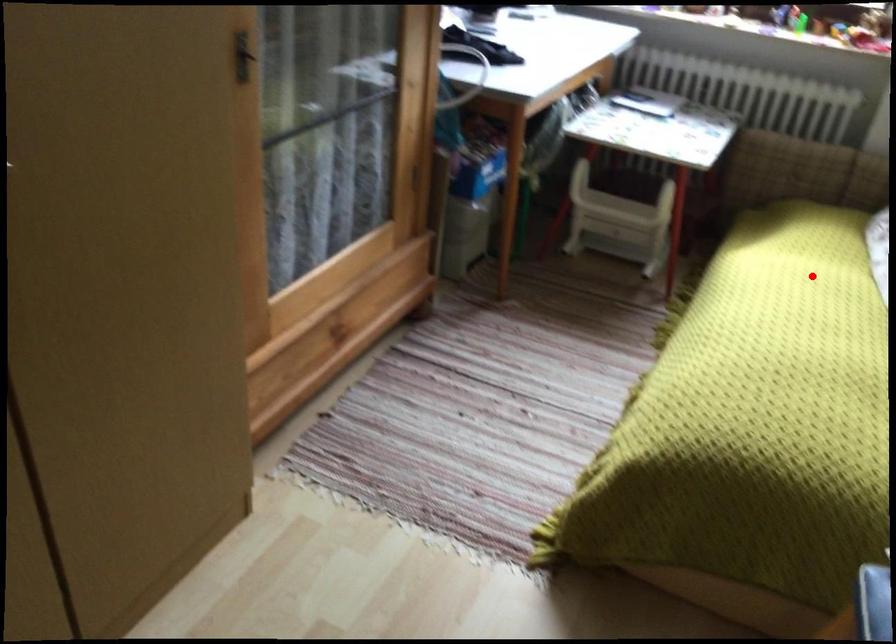
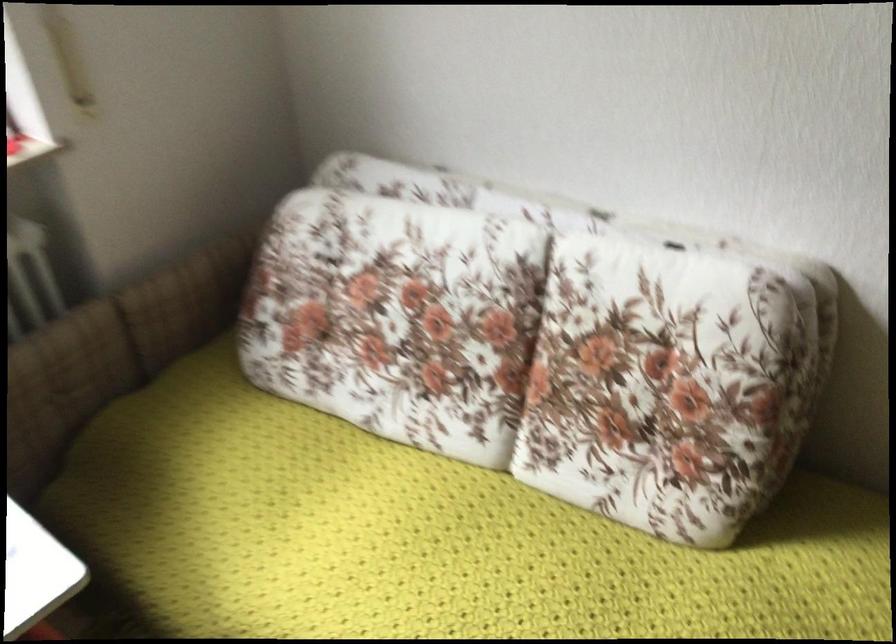
Find the pixel in the second image that matches the highlighted location in the first image.

(429, 538)